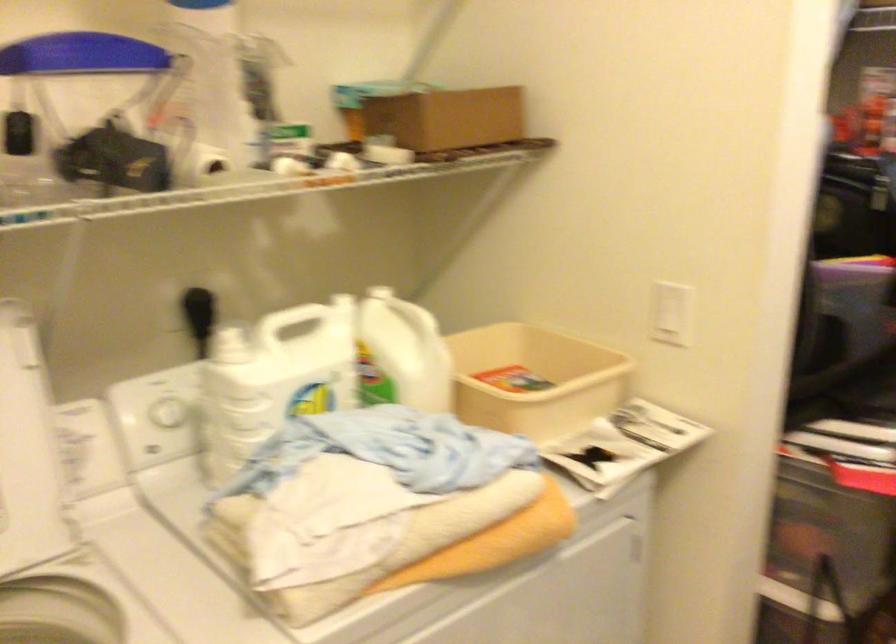
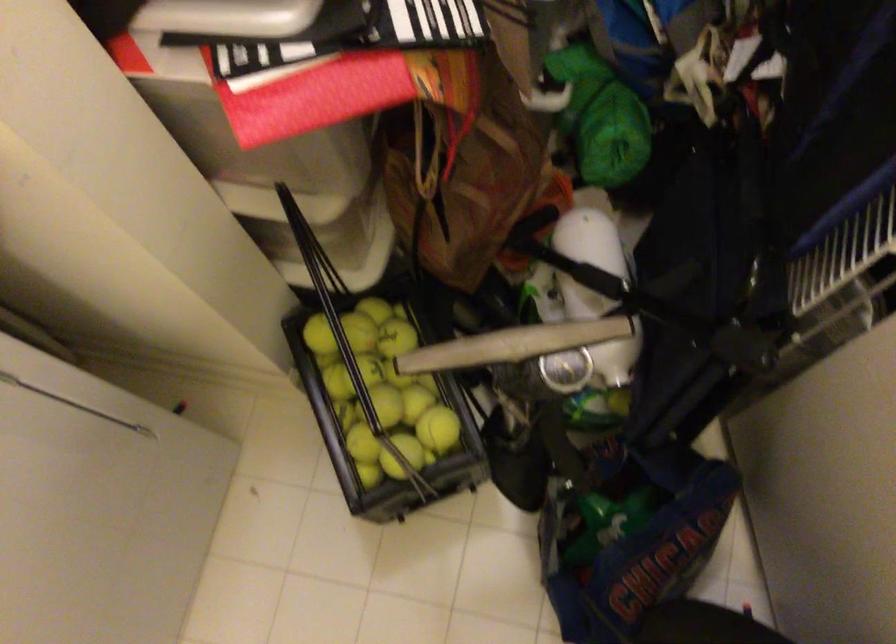
Question: The images are taken continuously from a first-person perspective. In which direction is your viewpoint rotating?

Choices:
 (A) Left
 (B) Right
 (C) Up
 (D) Down

Answer: (D)